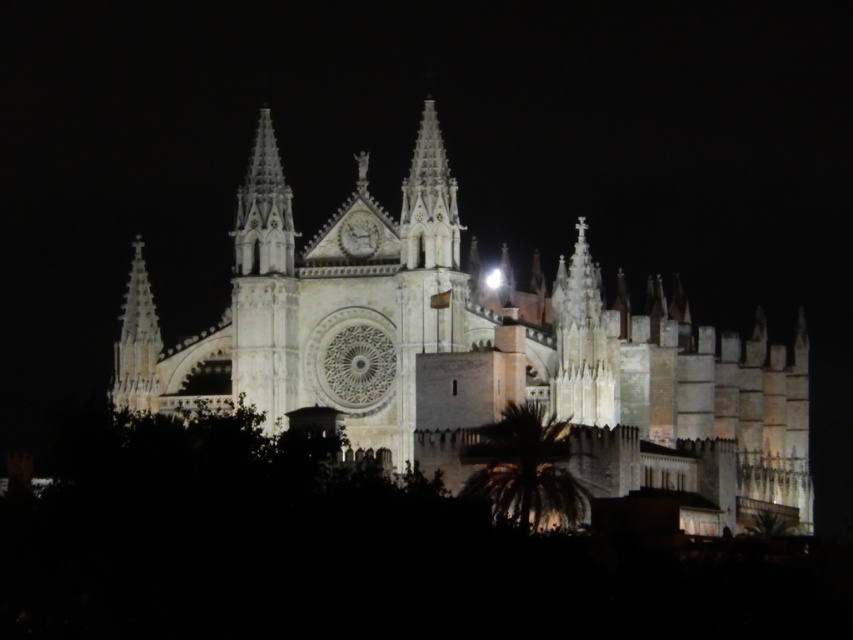
You are standing in front of the cathedral at night. You see a point marked at coordinates point (524, 467). What object is located at that point?

The point (524, 467) corresponds to the green leafy palm at lower center.